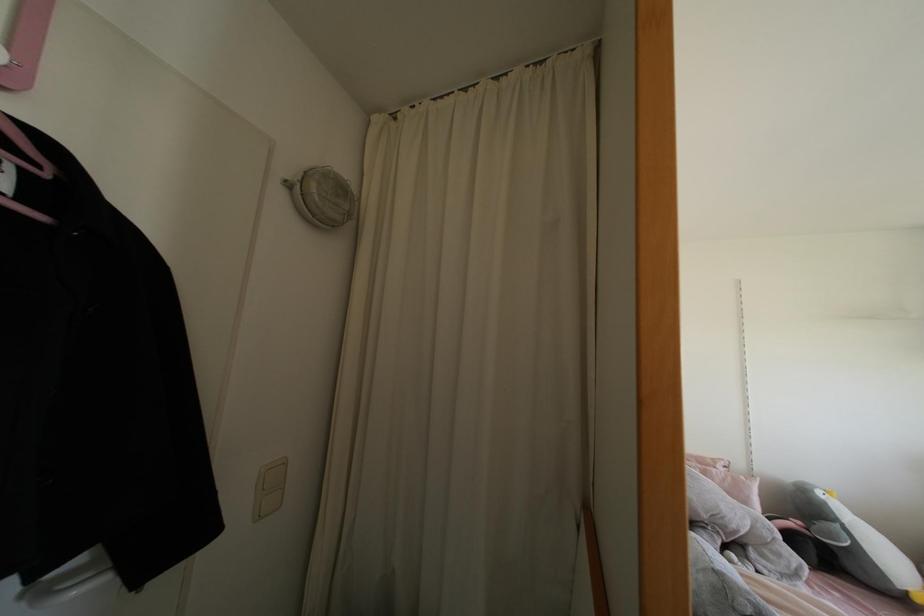
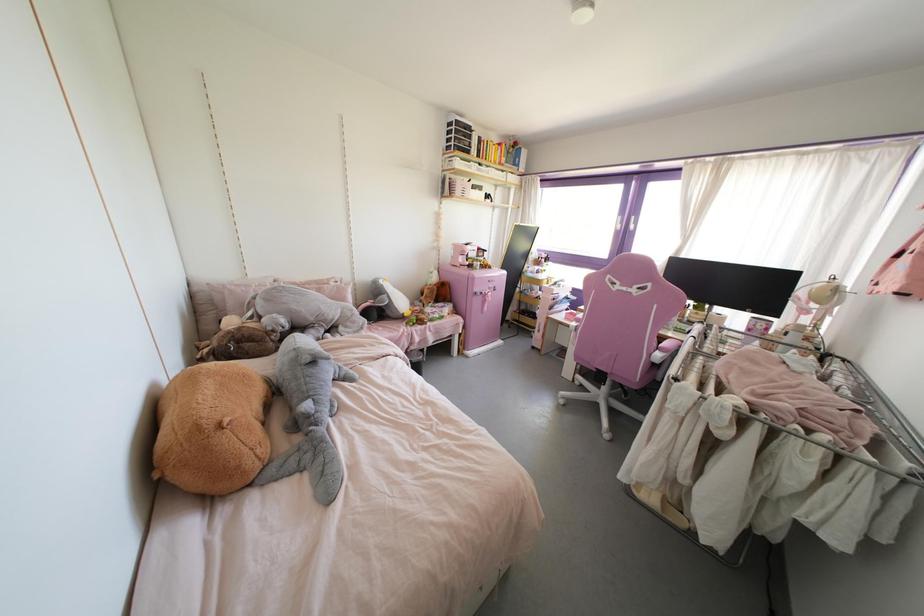
Based on the continuous images, in which direction is the camera rotating?

The camera's rotation is toward right-down.